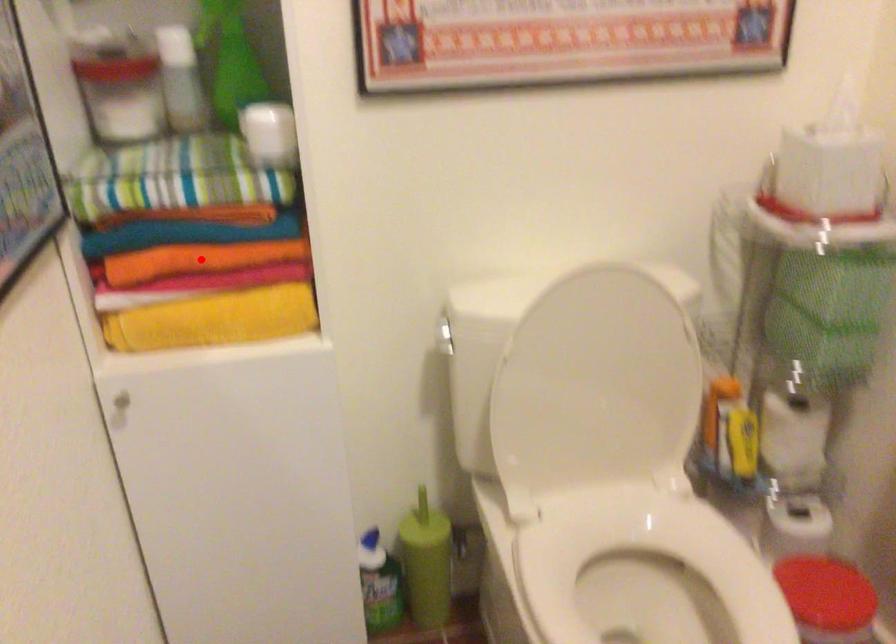
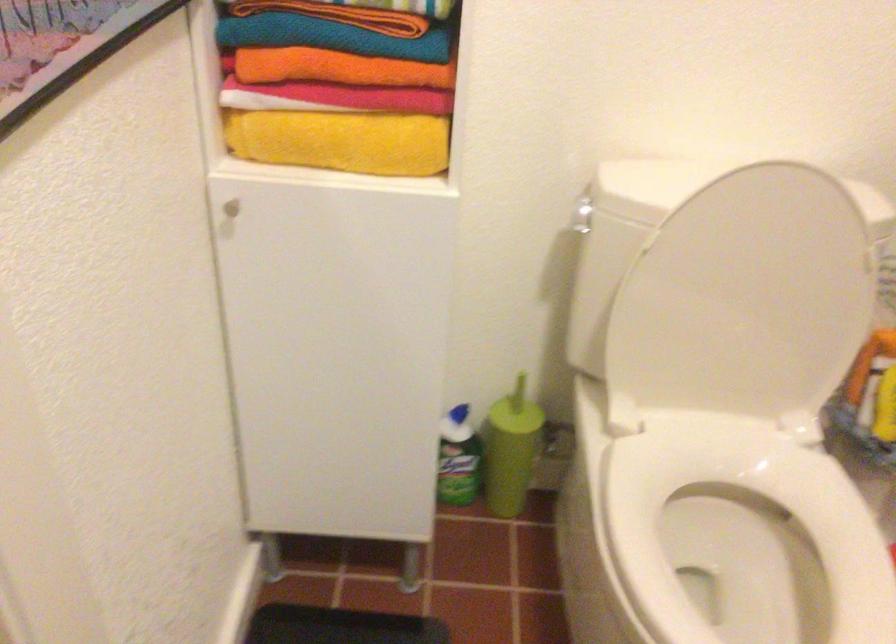
Question: I am providing you with two images of the same scene from different viewpoints. Image1 has a red point marked. In image2, the corresponding 3D location appears at what relative position? Reply with the corresponding letter.

Choices:
 (A) Closer
 (B) Farther

Answer: (A)